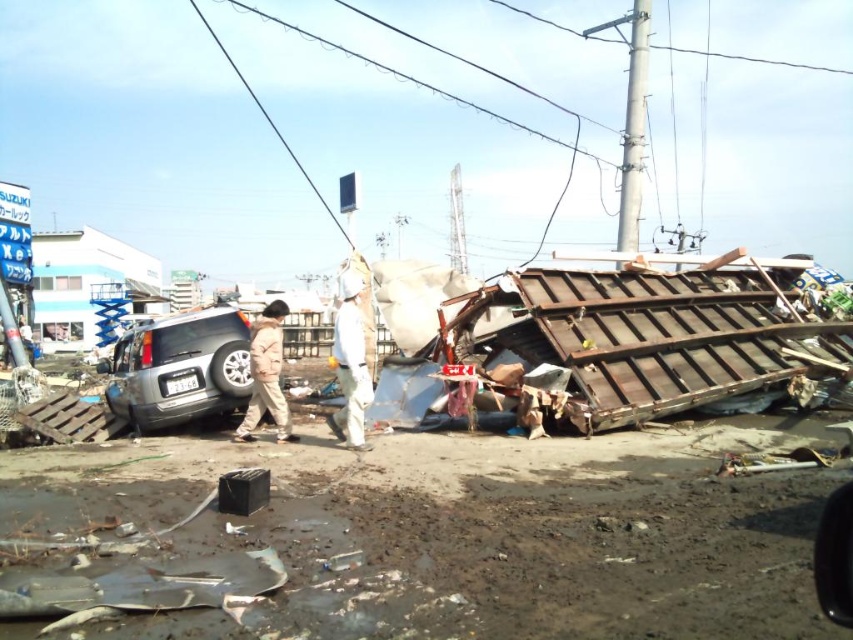
Question: Does white fabric at center have a larger size compared to khaki fabric jacket at center?

Choices:
 (A) no
 (B) yes

Answer: (B)

Question: Which of the following is the closest to the observer?

Choices:
 (A) silver metallic suv at center
 (B) khaki fabric jacket at center
 (C) white fabric at center

Answer: (C)

Question: Can you confirm if silver metallic suv at center is positioned below khaki fabric jacket at center?

Choices:
 (A) yes
 (B) no

Answer: (B)

Question: Which point is closer to the camera?

Choices:
 (A) (343, 340)
 (B) (148, 349)

Answer: (A)

Question: Does silver metallic suv at center appear over khaki fabric jacket at center?

Choices:
 (A) yes
 (B) no

Answer: (A)

Question: Which point is farther from the camera taking this photo?

Choices:
 (A) (166, 378)
 (B) (264, 394)
 (C) (347, 387)

Answer: (A)